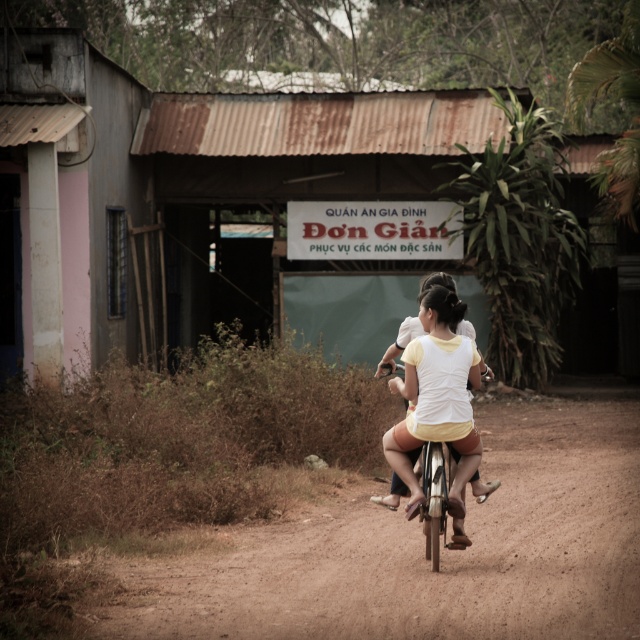
Does brown dirt track at center appear over white matte shirt at center?

Incorrect, brown dirt track at center is not positioned above white matte shirt at center.

Is brown dirt track at center below white matte shirt at center?

Yes.

Which is behind, point (180, 595) or point (420, 316)?

The point (420, 316) is behind.

What are the coordinates of `brown dirt track at center` in the screenshot? It's located at (422, 548).

Who is positioned more to the right, rusty metal hut at center or brown dirt track at center?

Positioned to the right is brown dirt track at center.

Describe the element at coordinates (198, 195) in the screenshot. I see `rusty metal hut at center` at that location.

The width and height of the screenshot is (640, 640). Find the location of `rusty metal hut at center`. rusty metal hut at center is located at coordinates (198, 195).

Which is above, rusty metal hut at center or white matte shirt at center?

rusty metal hut at center is above.

Can you confirm if rusty metal hut at center is bigger than white matte shirt at center?

Yes.

Which is in front, point (4, 68) or point (452, 385)?

Point (452, 385) is more forward.

This screenshot has height=640, width=640. I want to click on rusty metal hut at center, so click(198, 195).